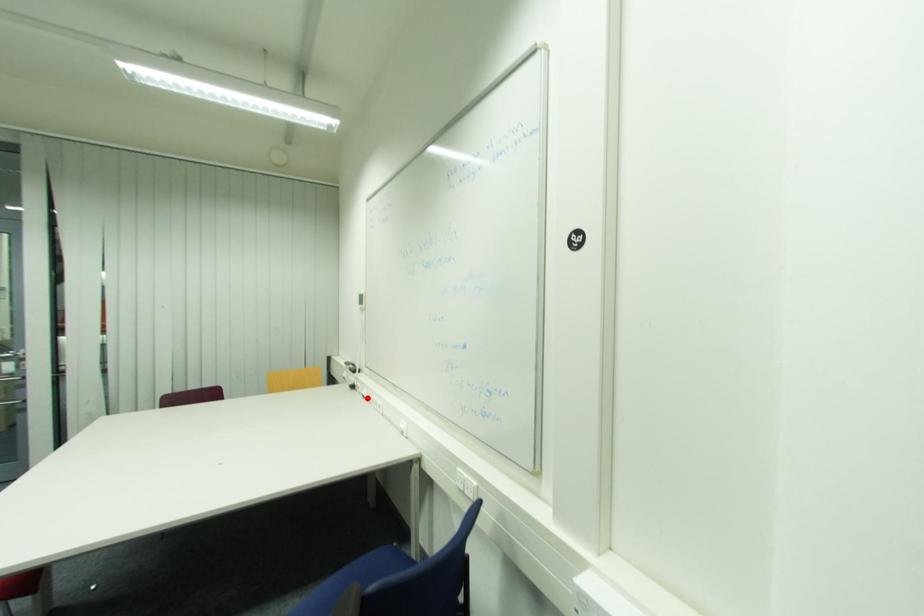
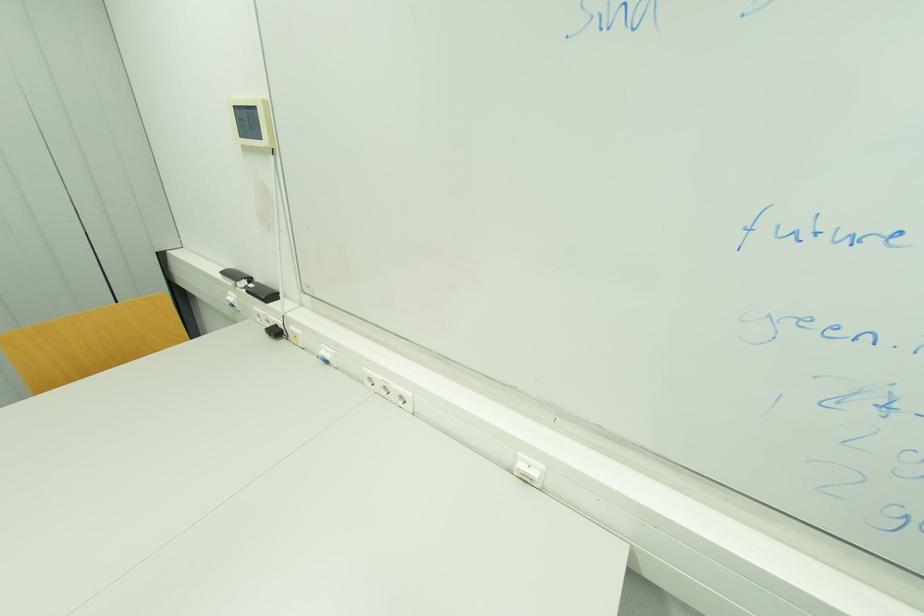
Question: I am providing you with two images of the same scene from different viewpoints. A red point is shown in image1. For the corresponding object point in image2, is it positioned nearer or farther from the camera?

Choices:
 (A) Nearer
 (B) Farther

Answer: (A)